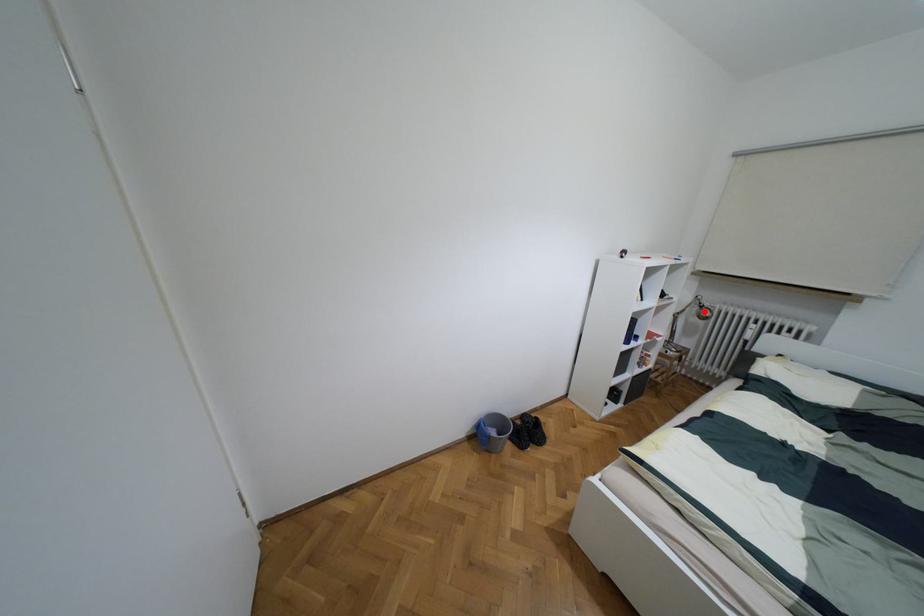
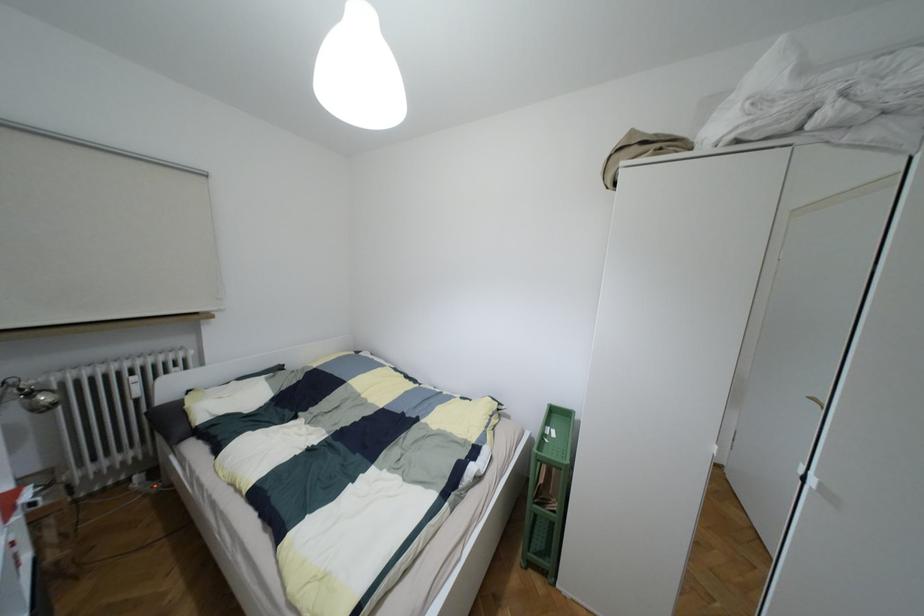
Question: A red point is marked in image1. In image2, is the corresponding 3D point closer to the camera or farther? Reply with the corresponding letter.

Choices:
 (A) The corresponding 3D point is closer.
 (B) The corresponding 3D point is farther.

Answer: (B)